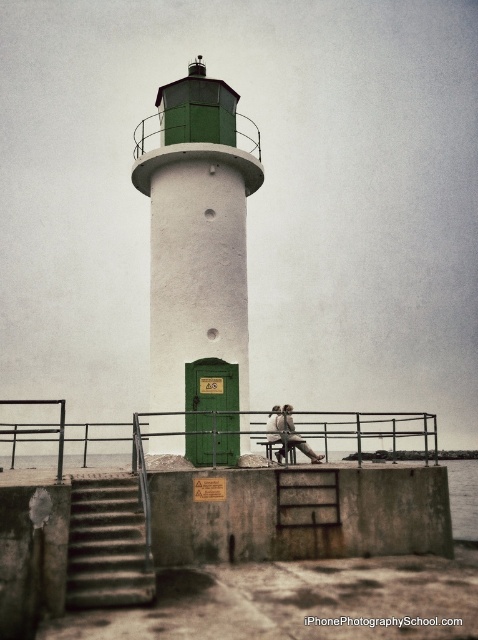
You are standing at the base of the lighthouse and want to reach the bench where the two individuals are seated. Which direction should you move relative to the black metal railing at lower center?

Answer: The black metal railing at lower center is located at point (369, 432), so you should move towards the railing to reach the bench where the individuals are seated.